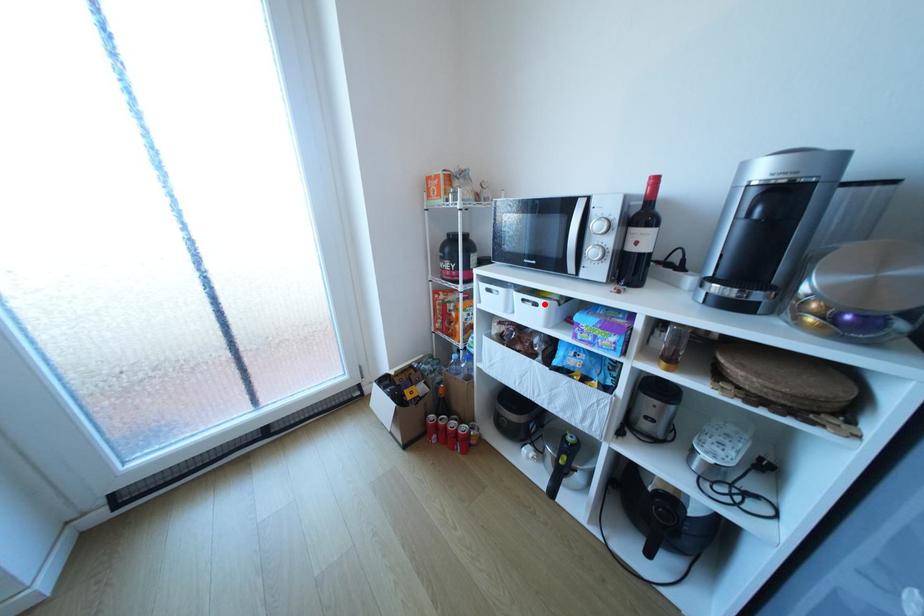
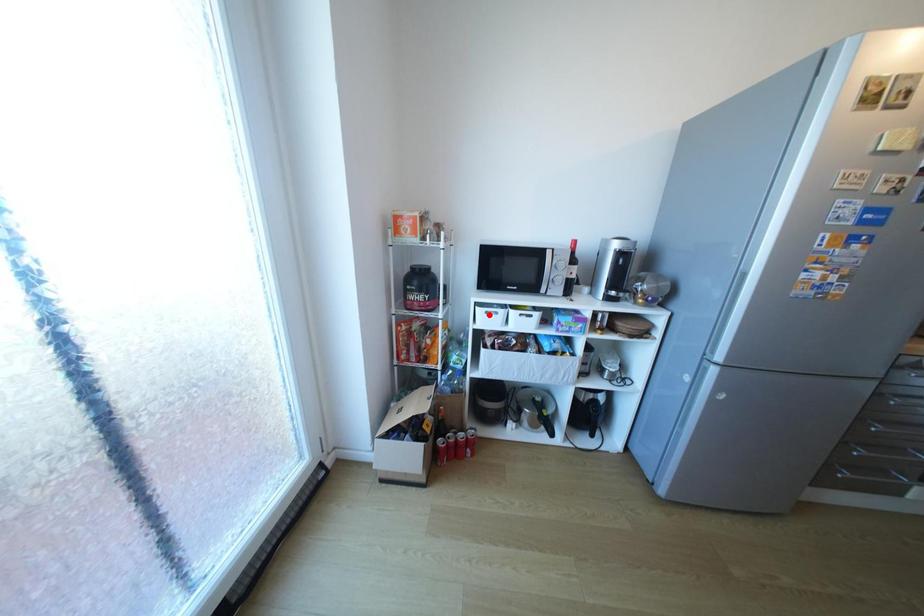
I am providing you with two images of the same scene from different viewpoints. A red point is marked on the first image and another point is marked on the second image. Do the highlighted points in image1 and image2 indicate the same real-world spot?

No